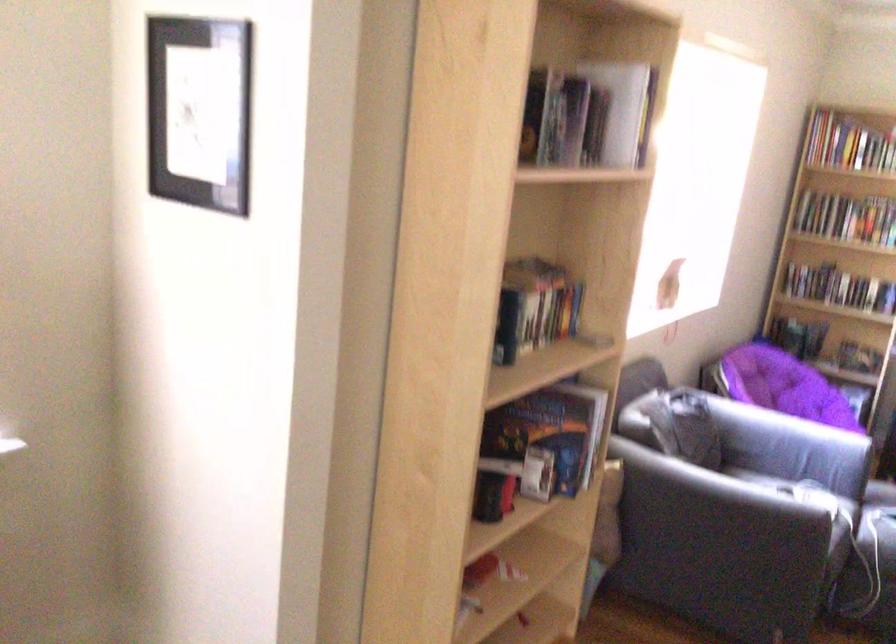
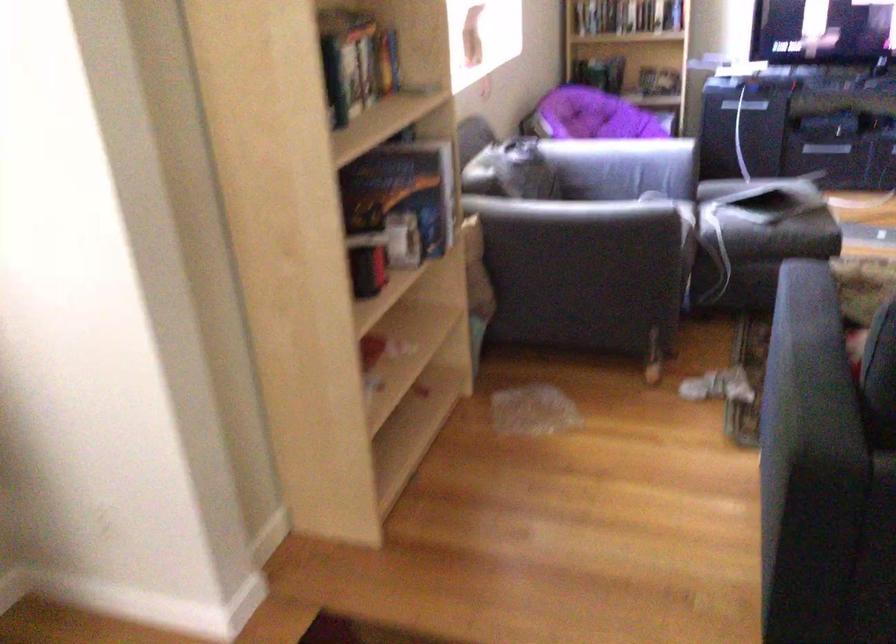
Locate, in the second image, the point that corresponds to point 782,462 in the first image.

(614, 187)